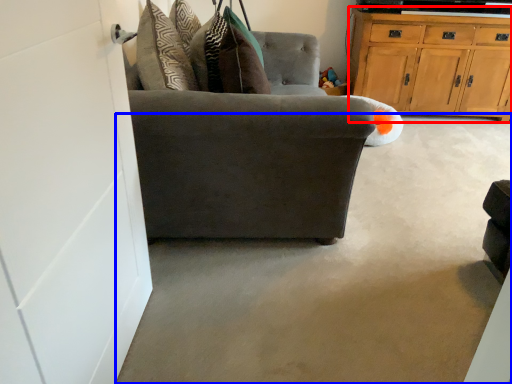
Question: Which object appears closest to the camera in this image, cabinetry (highlighted by a red box) or concrete (highlighted by a blue box)?

Choices:
 (A) cabinetry
 (B) concrete

Answer: (B)